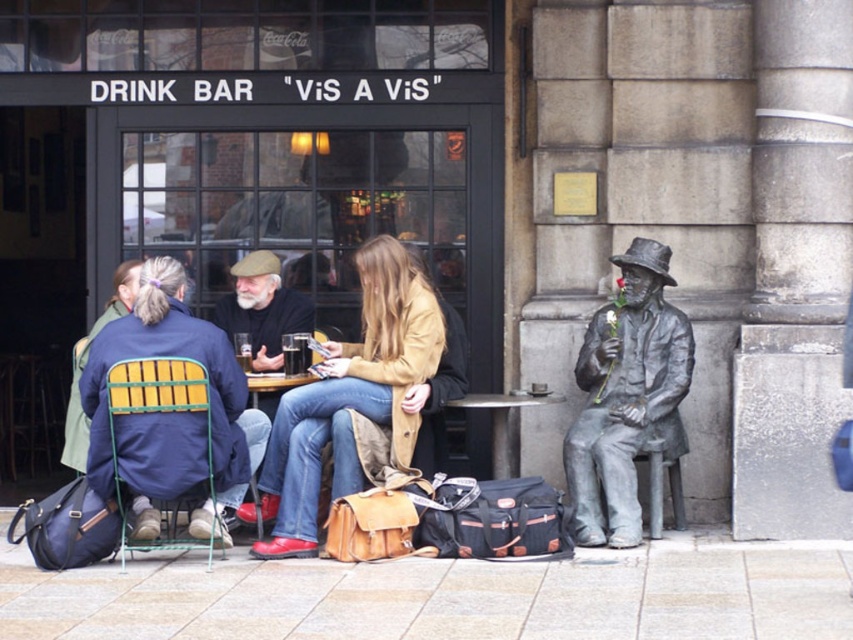
You are a server at the bar and need to deliver drinks to the two people wearing jackets at the table. The tray you are carrying is 36 inches wide. Can you place the tray between the matte blue jacket at center and the brown leather jacket at center without spilling?

The distance between the matte blue jacket at center and the brown leather jacket at center is 38.46 inches, which is wider than the tray. Therefore, you can safely place the tray between them without spilling.

You are a waiter at the bar and need to deliver a drink to the matte black cup at center. However, the brown leather jacket at center is covering it. Can you move the jacket to access the cup?

The brown leather jacket at center is positioned over matte black cup at center, so you can move the jacket to access the cup.